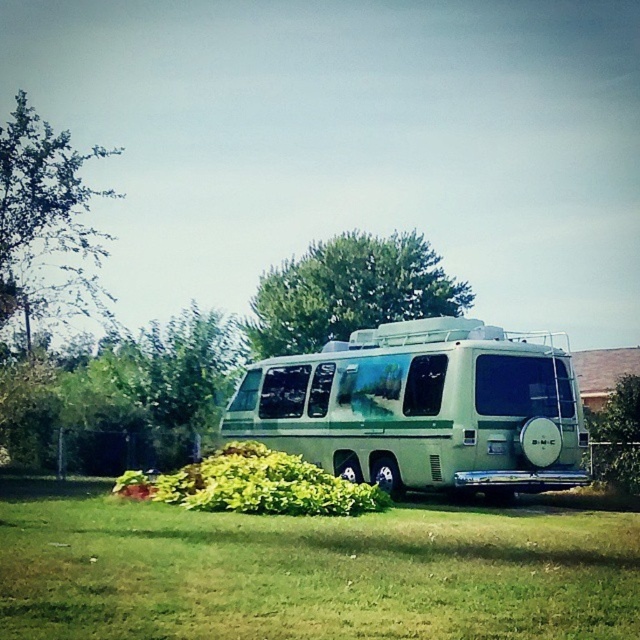
Is green grass at center positioned behind green leafy tree at upper left?

No, it is not.

Who is more distant from viewer, (154, 605) or (56, 147)?

The point (56, 147) is behind.

Image resolution: width=640 pixels, height=640 pixels. Find the location of `green grass at center`. green grass at center is located at coordinates (308, 570).

From the picture: Does green matte van at center have a greater height compared to green leafy tree at upper center?

No.

Consider the image. Is green matte van at center bigger than green leafy tree at upper center?

Incorrect, green matte van at center is not larger than green leafy tree at upper center.

Locate an element on the screen. Image resolution: width=640 pixels, height=640 pixels. green matte van at center is located at coordinates (422, 408).

Does green grass at center have a lesser width compared to green matte van at center?

No, green grass at center is not thinner than green matte van at center.

Does green grass at center have a larger size compared to green matte van at center?

No.

Is point (208, 632) positioned after point (372, 401)?

No, it is not.

Where is `green grass at center`? green grass at center is located at coordinates (308, 570).